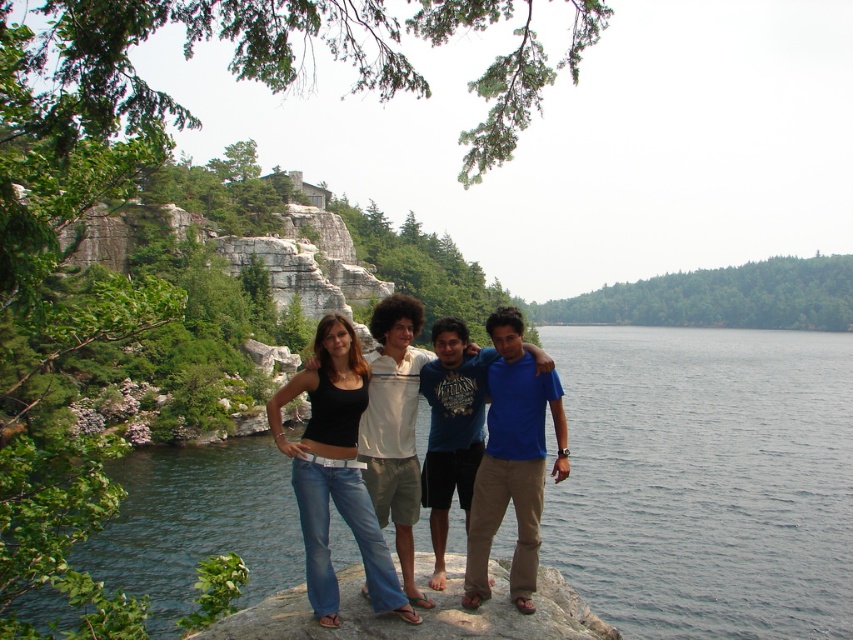
You are standing at the edge of the lake looking towards the group of four people. The blue cotton shirt at center is located at point (512, 461). If you want to take a photo of the blue cotton shirt at center, where should you aim your camera?

You should aim your camera at point (512, 461) to capture the blue cotton shirt at center.

You are a photographer trying to capture a clear shot of the black denim jeans at center and the smooth gray rock at lower center. Since you want both objects in focus, which one should you adjust your camera focus on first to ensure the thinner object is sharp?

The black denim jeans at center is thinner than the smooth gray rock at lower center, so you should focus on the black denim jeans at center first to ensure it is sharp before adjusting for the thicker rock.